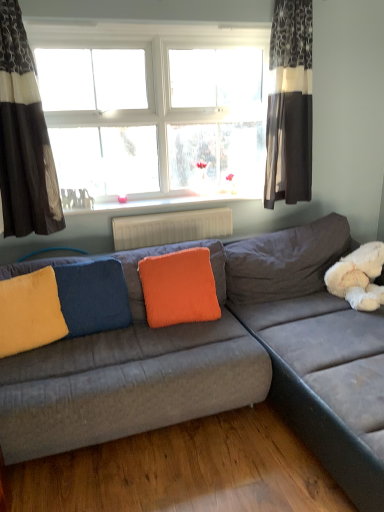
Question: Could white glossy radiator at upper center be considered to be inside dark gray textured curtain at left, positioned as the first curtain in left-to-right order?

Choices:
 (A) yes
 (B) no

Answer: (B)

Question: Is dark gray textured curtain at left, the second curtain when ordered from right to left, thinner than white glossy radiator at upper center?

Choices:
 (A) yes
 (B) no

Answer: (A)

Question: From a real-world perspective, is dark gray textured curtain at left, positioned as the first curtain in left-to-right order, located higher than white glossy radiator at upper center?

Choices:
 (A) no
 (B) yes

Answer: (B)

Question: Is dark gray textured curtain at left, positioned as the first curtain in left-to-right order, to the left of white glossy radiator at upper center from the viewer's perspective?

Choices:
 (A) yes
 (B) no

Answer: (A)

Question: Is dark gray textured curtain at left, the second curtain when ordered from right to left, touching white glossy radiator at upper center?

Choices:
 (A) no
 (B) yes

Answer: (A)

Question: Is dark gray textured curtain at left, positioned as the first curtain in left-to-right order, bigger or smaller than velvet gray couch at center?

Choices:
 (A) big
 (B) small

Answer: (B)

Question: Visually, is dark gray textured curtain at left, positioned as the first curtain in left-to-right order, positioned to the left or to the right of velvet gray couch at center?

Choices:
 (A) left
 (B) right

Answer: (A)

Question: Which is correct: dark gray textured curtain at left, the second curtain when ordered from right to left, is inside velvet gray couch at center, or outside of it?

Choices:
 (A) inside
 (B) outside

Answer: (B)

Question: Relative to velvet gray couch at center, is dark gray textured curtain at left, the second curtain when ordered from right to left, in front or behind?

Choices:
 (A) behind
 (B) front

Answer: (A)

Question: Considering the positions of point (125, 221) and point (122, 308), is point (125, 221) closer or farther from the camera than point (122, 308)?

Choices:
 (A) farther
 (B) closer

Answer: (A)

Question: From the image's perspective, is white plastic radiator at center above or below blue velvet pillow at center, the 2th pillow when ordered from right to left?

Choices:
 (A) below
 (B) above

Answer: (B)

Question: Is white plastic radiator at center taller or shorter than blue velvet pillow at center, marked as the second pillow in a left-to-right arrangement?

Choices:
 (A) short
 (B) tall

Answer: (A)

Question: In the image, is white plastic radiator at center positioned in front of or behind blue velvet pillow at center, the 2th pillow when ordered from right to left?

Choices:
 (A) behind
 (B) front

Answer: (A)

Question: From a real-world perspective, relative to white glass window at upper center, is velvet gray couch at center vertically above or below?

Choices:
 (A) below
 (B) above

Answer: (A)

Question: Considering their positions, is velvet gray couch at center located in front of or behind white glass window at upper center?

Choices:
 (A) front
 (B) behind

Answer: (A)